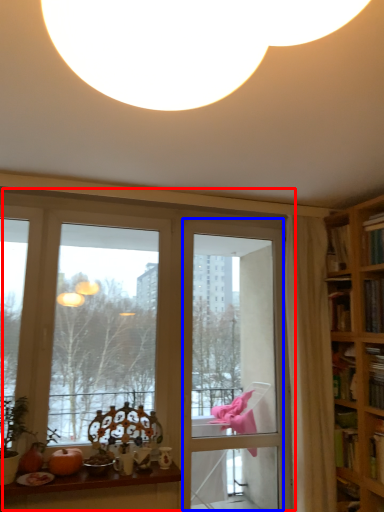
Question: Which of the following is the farthest to the observer, window (highlighted by a red box) or screen door (highlighted by a blue box)?

Choices:
 (A) window
 (B) screen door

Answer: (B)